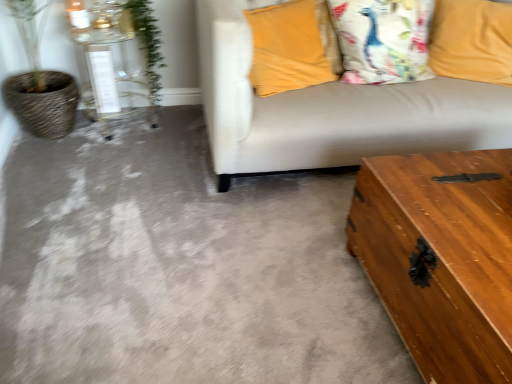
Question: Considering the relative sizes of yellow fabric pillow at upper right, the first pillow from the right, and green leafy plant at upper left in the image provided, is yellow fabric pillow at upper right, the first pillow from the right, bigger than green leafy plant at upper left?

Choices:
 (A) no
 (B) yes

Answer: (B)

Question: Could you tell me if yellow fabric pillow at upper right, the 3th pillow from the left, is turned towards green leafy plant at upper left?

Choices:
 (A) no
 (B) yes

Answer: (A)

Question: From the image's perspective, is yellow fabric pillow at upper right, the first pillow from the right, located above green leafy plant at upper left?

Choices:
 (A) no
 (B) yes

Answer: (B)

Question: Does yellow fabric pillow at upper right, the 3th pillow from the left, lie in front of green leafy plant at upper left?

Choices:
 (A) yes
 (B) no

Answer: (B)

Question: Is yellow fabric pillow at upper right, the 3th pillow from the left, taller than green leafy plant at upper left?

Choices:
 (A) yes
 (B) no

Answer: (B)

Question: Is velvet yellow pillow at upper right, the 1th pillow in the left-to-right sequence, wider or thinner than wooden trunk at lower right?

Choices:
 (A) wide
 (B) thin

Answer: (B)

Question: Considering their positions, is velvet yellow pillow at upper right, positioned as the third pillow in right-to-left order, located in front of or behind wooden trunk at lower right?

Choices:
 (A) front
 (B) behind

Answer: (B)

Question: From the image's perspective, is velvet yellow pillow at upper right, positioned as the third pillow in right-to-left order, above or below wooden trunk at lower right?

Choices:
 (A) below
 (B) above

Answer: (B)

Question: In terms of size, does velvet yellow pillow at upper right, positioned as the third pillow in right-to-left order, appear bigger or smaller than wooden trunk at lower right?

Choices:
 (A) small
 (B) big

Answer: (A)

Question: Based on their sizes in the image, would you say wooden trunk at lower right is bigger or smaller than wooden trunk at lower right, which is the first table in front-to-back order?

Choices:
 (A) small
 (B) big

Answer: (A)

Question: Considering the positions of wooden trunk at lower right and wooden trunk at lower right, arranged as the second table when viewed from the back, in the image, is wooden trunk at lower right taller or shorter than wooden trunk at lower right, arranged as the second table when viewed from the back,?

Choices:
 (A) tall
 (B) short

Answer: (B)

Question: Which is correct: wooden trunk at lower right is inside wooden trunk at lower right, the 1th table ordered from the bottom, or outside of it?

Choices:
 (A) outside
 (B) inside

Answer: (A)

Question: From a real-world perspective, is wooden trunk at lower right physically located above or below wooden trunk at lower right, the 2th table in the left-to-right sequence?

Choices:
 (A) above
 (B) below

Answer: (B)

Question: From their relative heights in the image, would you say white cotton pillow at upper right, the 2th pillow positioned from the right, is taller or shorter than green leafy plant at upper left?

Choices:
 (A) tall
 (B) short

Answer: (B)

Question: Is point (384, 74) positioned closer to the camera than point (157, 46)?

Choices:
 (A) closer
 (B) farther

Answer: (A)